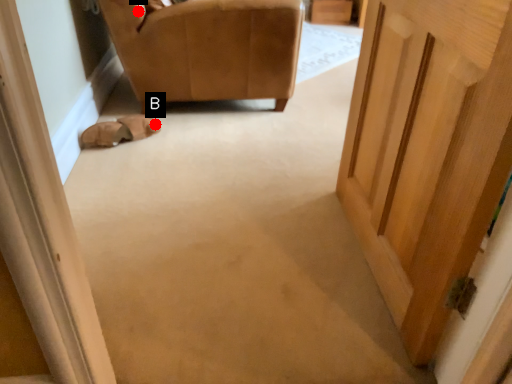
Question: Two points are circled on the image, labeled by A and B beside each circle. Which point is closer to the camera?

Choices:
 (A) A is closer
 (B) B is closer

Answer: (A)